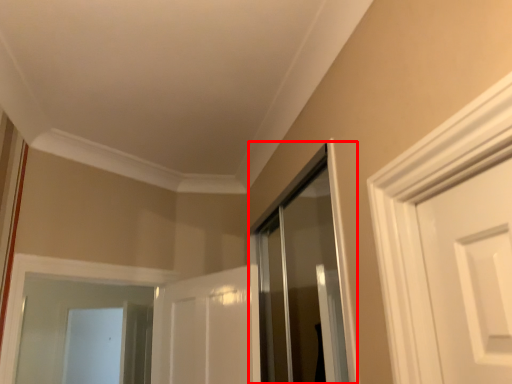
Question: From the image's perspective, where is shower door (annotated by the red box) located in relation to screen door in the image?

Choices:
 (A) above
 (B) below

Answer: (A)